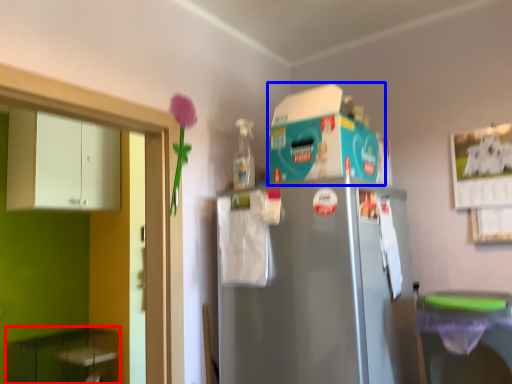
Question: Which object is closer to the camera taking this photo, cabinetry (highlighted by a red box) or appliance (highlighted by a blue box)?

Choices:
 (A) cabinetry
 (B) appliance

Answer: (B)